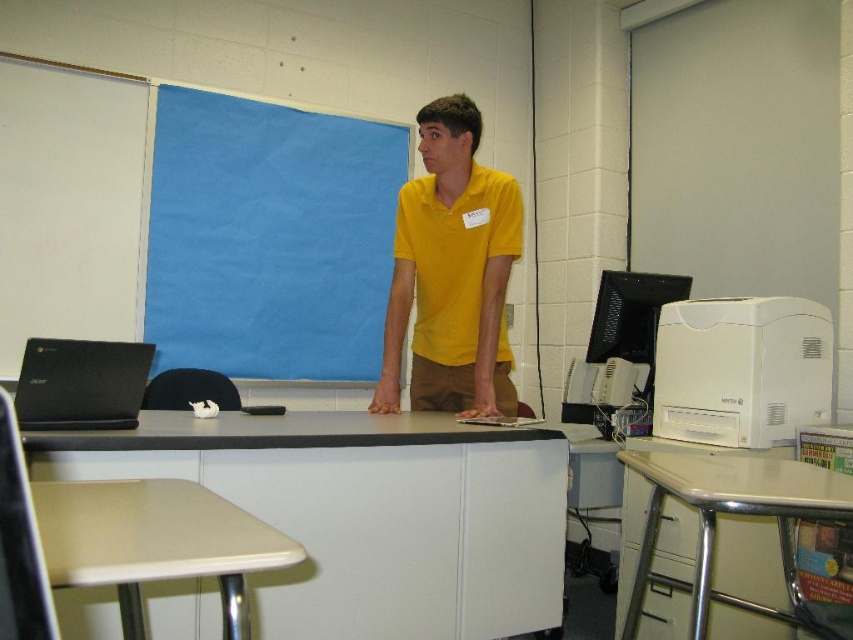
Question: Which of these objects is positioned farthest from the white plastic table at center?

Choices:
 (A) beige plastic table at lower left
 (B) metallic beige table at lower right
 (C) yellow matte shirt at center

Answer: (A)

Question: Is white plastic table at center below beige plastic table at lower left?

Choices:
 (A) yes
 (B) no

Answer: (A)

Question: Among these objects, which one is farthest from the camera?

Choices:
 (A) blue fabric at upper center
 (B) black matte laptop at left

Answer: (A)

Question: Is white plastic table at center below beige plastic table at lower left?

Choices:
 (A) no
 (B) yes

Answer: (B)

Question: Can you confirm if blue fabric at upper center is positioned below beige plastic table at lower left?

Choices:
 (A) no
 (B) yes

Answer: (A)

Question: Which object is the farthest from the black matte laptop at left?

Choices:
 (A) yellow matte shirt at center
 (B) blue fabric at upper center
 (C) metallic beige table at lower right
 (D) white plastic table at center

Answer: (B)